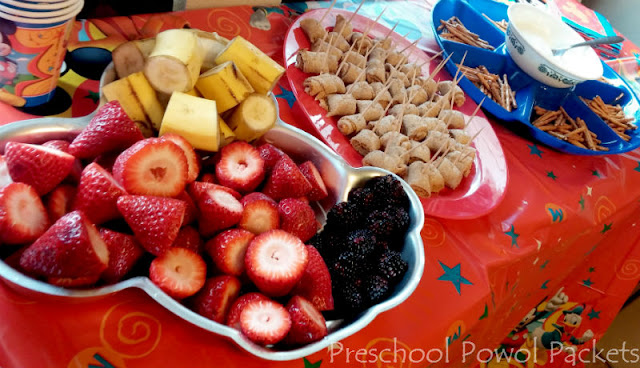
Identify the location of blue serviing trey. (543, 89).